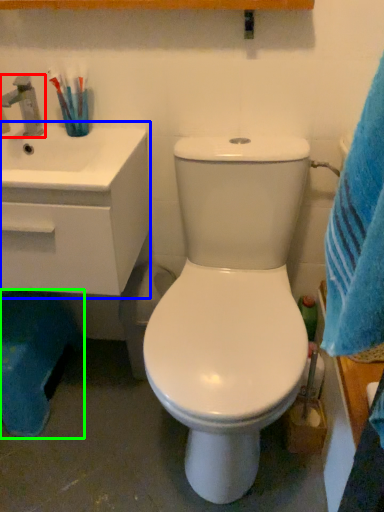
Question: Considering the real-world distances, which object is closest to tap (highlighted by a red box)? counter top (highlighted by a blue box) or potty (highlighted by a green box).

Choices:
 (A) counter top
 (B) potty

Answer: (A)